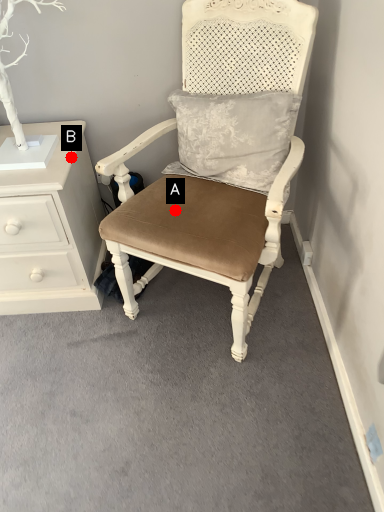
Question: Two points are circled on the image, labeled by A and B beside each circle. Which of the following is the closest to the observer?

Choices:
 (A) A is closer
 (B) B is closer

Answer: (A)